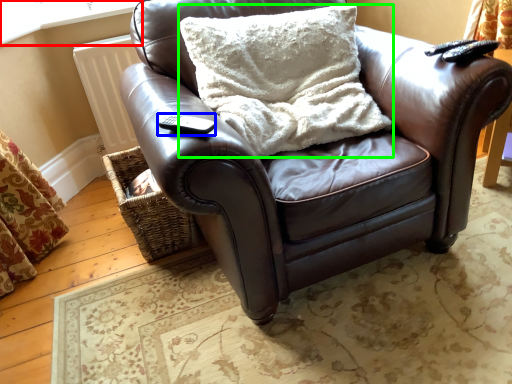
Question: Considering the real-world distances, which object is closest to window frame (highlighted by a red box)? remote (highlighted by a blue box) or pillow (highlighted by a green box).

Choices:
 (A) remote
 (B) pillow

Answer: (B)